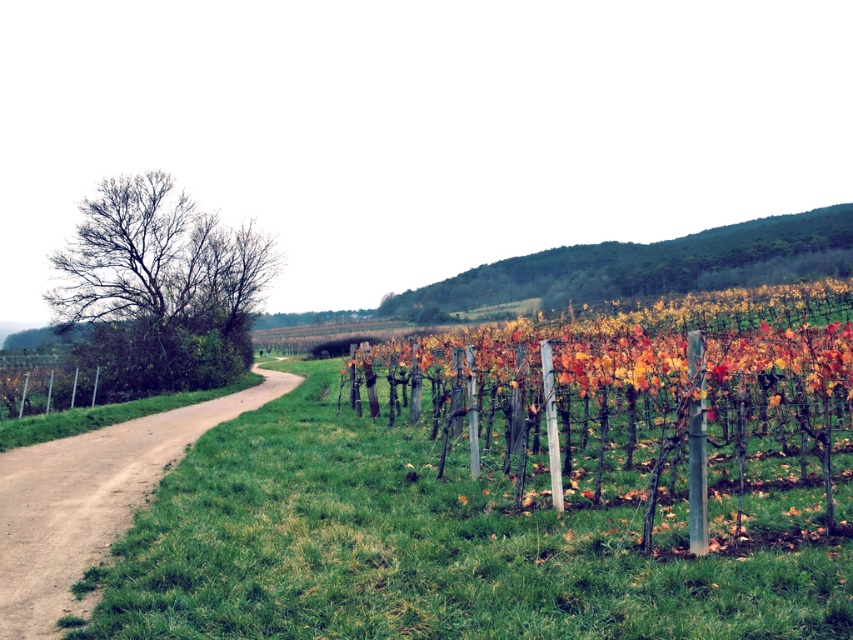
Who is more forward, (730, 440) or (26, 532)?

Point (26, 532)

Who is higher up, autumn leaves at center or brown dirt track at left?

autumn leaves at center

Where is `autumn leaves at center`? The width and height of the screenshot is (853, 640). autumn leaves at center is located at coordinates (634, 396).

Between point (692, 404) and point (747, 269), which one is positioned behind?

The point (747, 269) is more distant.

The image size is (853, 640). Describe the element at coordinates (634, 396) in the screenshot. I see `autumn leaves at center` at that location.

You are a GUI agent. You are given a task and a screenshot of the screen. Output one action in this format:
    pyautogui.click(x=<x>, y=<y>)
    Task: Click on the autumn leaves at center
    
    Given the screenshot: What is the action you would take?
    click(634, 396)

Between point (51, 500) and point (531, 289), which one is positioned behind?

Point (531, 289)

At what (x,y) coordinates should I click in order to perform the action: click on brown dirt track at left. Please return your answer as a coordinate pair (x, y). Looking at the image, I should click on (90, 500).

Identify the location of brown dirt track at left. This screenshot has height=640, width=853. (90, 500).